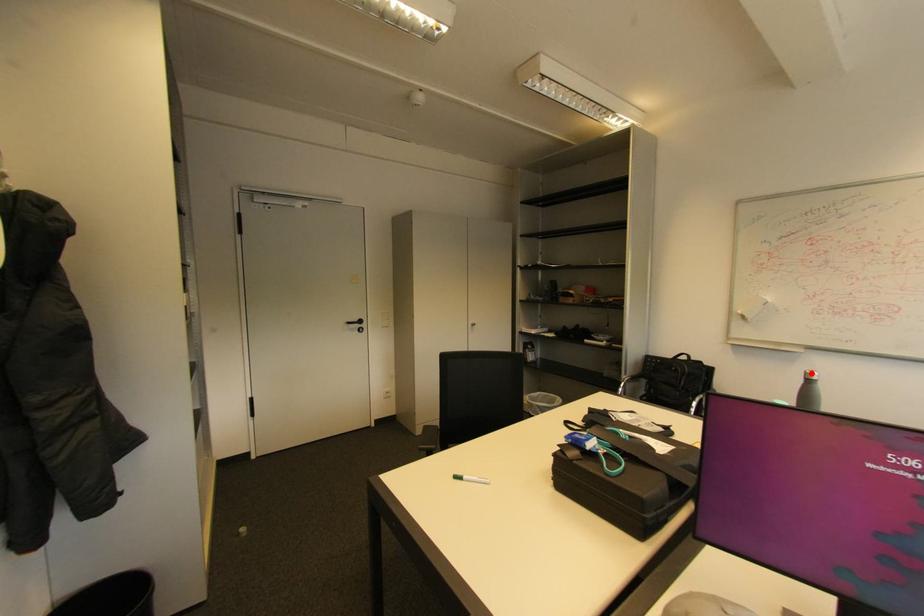
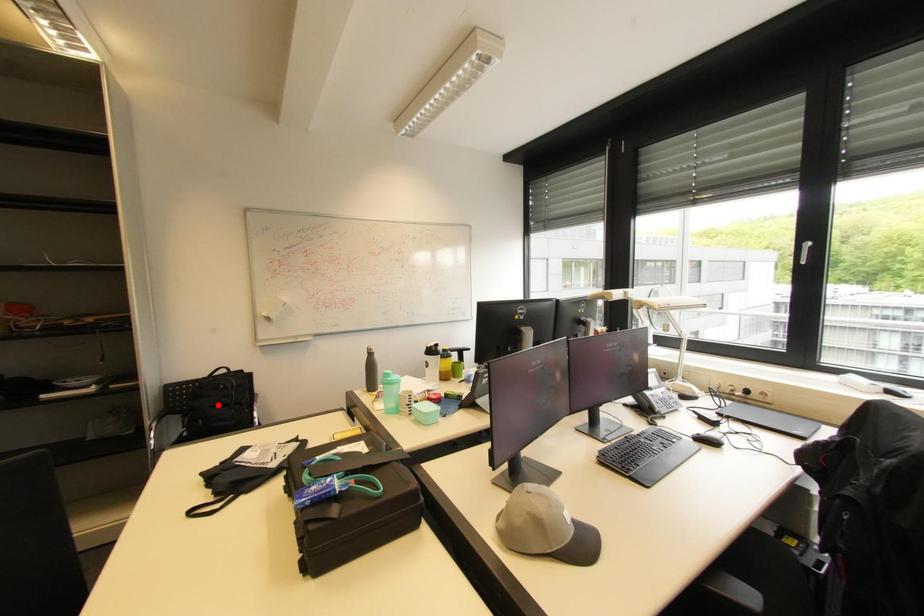
I am providing you with two images of the same scene from different viewpoints. A red point is marked on the first image and another point is marked on the second image. Does the point marked in image1 correspond to the same location as the one in image2?

No